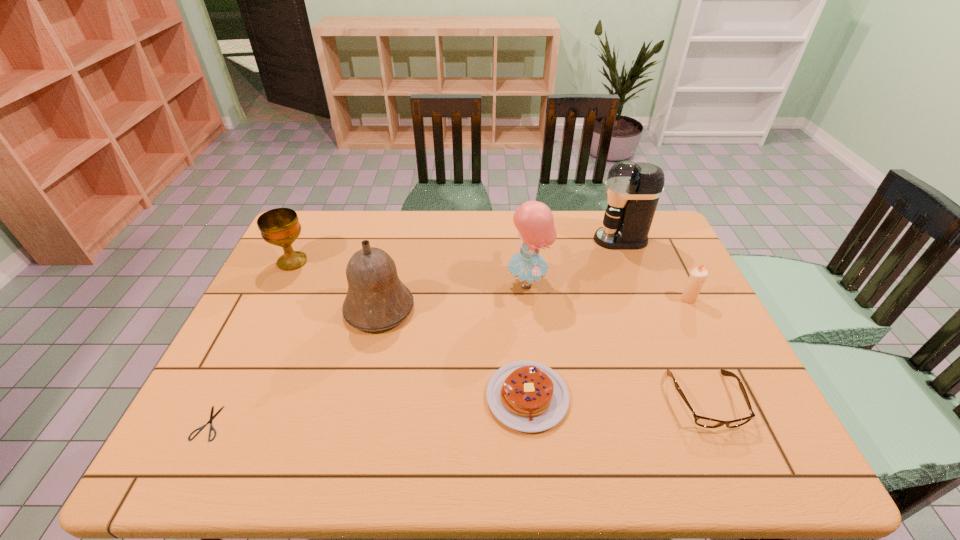
The height and width of the screenshot is (540, 960). I want to click on coffee maker, so click(x=633, y=190).

Image resolution: width=960 pixels, height=540 pixels. Identify the location of doll. (534, 220).

Locate an element on the screen. The width and height of the screenshot is (960, 540). bell is located at coordinates (376, 300).

Find the location of a particular element. This screenshot has width=960, height=540. the third object from left to right is located at coordinates 376,300.

At what (x,y) coordinates should I click in order to perform the action: click on chalice. Please return your answer as a coordinate pair (x, y). Looking at the image, I should click on (280, 227).

The width and height of the screenshot is (960, 540). Find the location of `candle`. candle is located at coordinates (698, 275).

Identify the location of spectacles. click(x=705, y=422).

You are a GUI agent. You are given a task and a screenshot of the screen. Output one action in this format:
    pyautogui.click(x=<x>, y=<y>)
    Task: Click on the pancake
    This screenshot has width=960, height=540.
    Given the screenshot: What is the action you would take?
    pyautogui.click(x=527, y=396)

This screenshot has width=960, height=540. Identify the location of the shortest object. (212, 417).

At what (x,y) coordinates should I click in order to perform the action: click on free location located 0.270m place cup under the spout of the coffee maker. Please return your answer as a coordinate pair (x, y). This screenshot has height=540, width=960. Looking at the image, I should click on (515, 240).